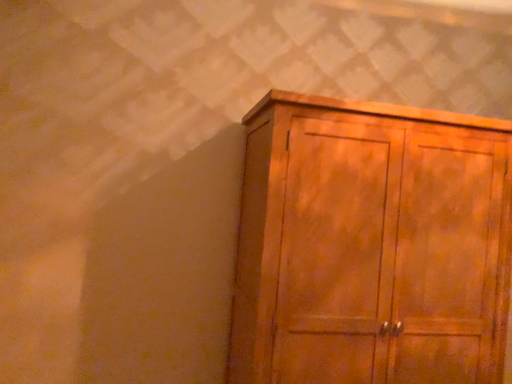
The image size is (512, 384). I want to click on wooden cabinet at upper right, so click(x=371, y=244).

The image size is (512, 384). Describe the element at coordinates (371, 244) in the screenshot. I see `wooden cabinet at upper right` at that location.

Identify the location of wooden cabinet at upper right. (371, 244).